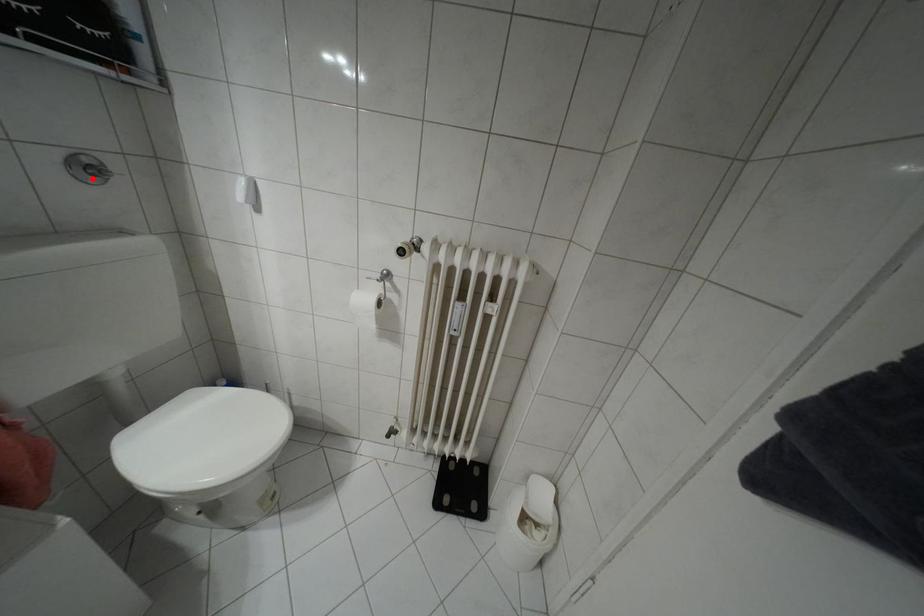
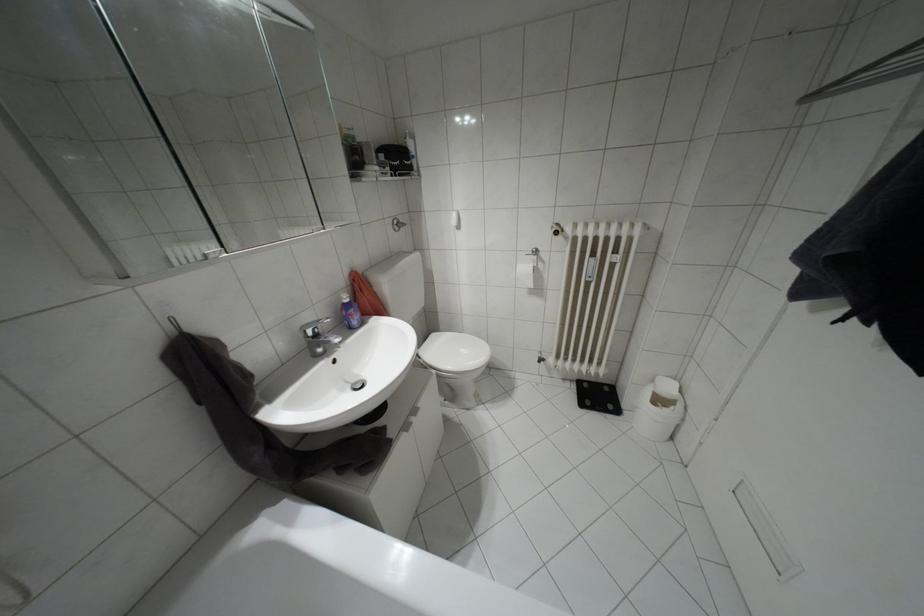
In the second image, find the point that corresponds to the highlighted location in the first image.

(395, 229)